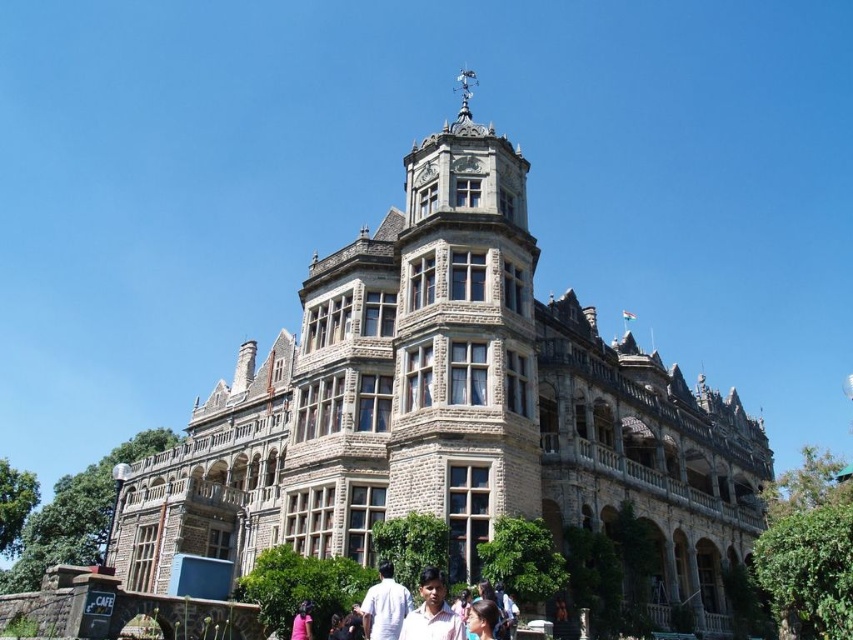
Question: Where is stone tower at center located in relation to pink fabric at lower center in the image?

Choices:
 (A) above
 (B) below

Answer: (A)

Question: Which object appears farthest from the camera in this image?

Choices:
 (A) stone castle at center
 (B) pink fabric shirt at center
 (C) white cotton shirt at center

Answer: (A)

Question: Which point is farther to the camera?

Choices:
 (A) pink fabric at lower center
 (B) stone tower at center
 (C) white cotton shirt at center

Answer: (B)

Question: Which object appears closest to the camera in this image?

Choices:
 (A) stone castle at center
 (B) white cotton shirt at center

Answer: (B)

Question: Is stone tower at center in front of pink fabric at lower center?

Choices:
 (A) yes
 (B) no

Answer: (B)

Question: Is stone tower at center above pink fabric at lower center?

Choices:
 (A) yes
 (B) no

Answer: (A)